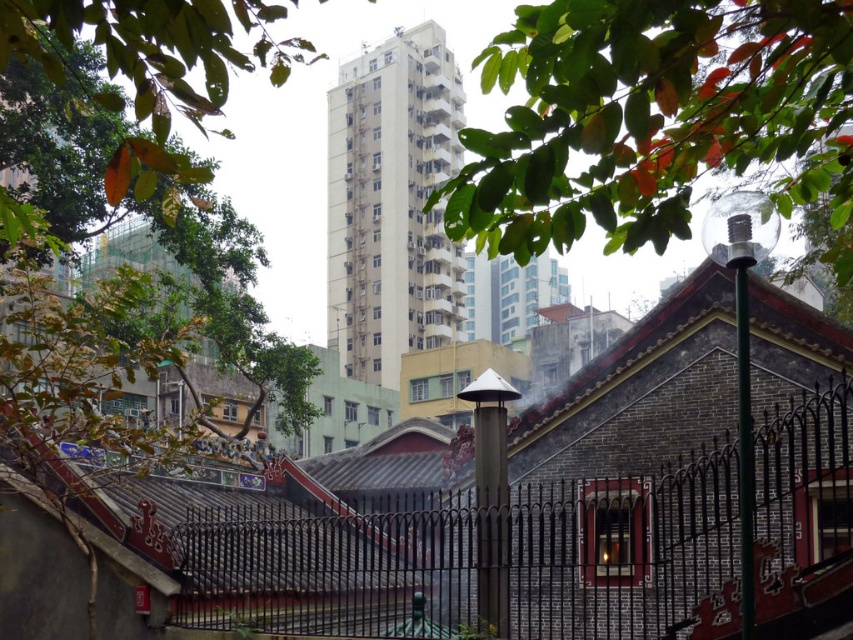
Question: Does green leafy tree at upper center appear over green leafy tree at left?

Choices:
 (A) no
 (B) yes

Answer: (A)

Question: Is green leafy tree at upper center positioned at the back of green leafy tree at left?

Choices:
 (A) yes
 (B) no

Answer: (A)

Question: Does black wrought iron fence at lower left appear under green leafy tree at left?

Choices:
 (A) no
 (B) yes

Answer: (B)

Question: Based on their relative distances, which object is farther from the green leafy tree at upper center?

Choices:
 (A) green leafy tree at left
 (B) black wrought iron fence at lower left

Answer: (A)

Question: Which of the following is the farthest from the observer?

Choices:
 (A) green leafy tree at left
 (B) black wrought iron fence at lower left
 (C) green leafy tree at upper center

Answer: (B)

Question: Among these points, which one is nearest to the camera?

Choices:
 (A) (540, 45)
 (B) (311, 45)

Answer: (A)